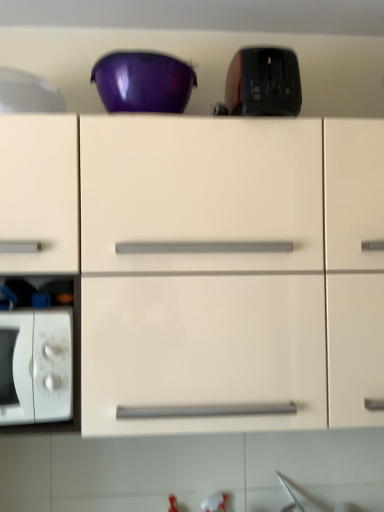
Question: Can you confirm if black glossy toaster at upper center, the second appliance positioned from the left, is taller than matte white cabinet at center?

Choices:
 (A) no
 (B) yes

Answer: (A)

Question: Does black glossy toaster at upper center, the second appliance positioned from the left, turn towards matte white cabinet at center?

Choices:
 (A) yes
 (B) no

Answer: (B)

Question: Is black glossy toaster at upper center, which is the first appliance in right-to-left order, touching matte white cabinet at center?

Choices:
 (A) no
 (B) yes

Answer: (A)

Question: Is black glossy toaster at upper center, the second appliance positioned from the left, completely or partially outside of matte white cabinet at center?

Choices:
 (A) yes
 (B) no

Answer: (A)

Question: Considering the relative sizes of black glossy toaster at upper center, which is the first appliance in right-to-left order, and matte white cabinet at center in the image provided, is black glossy toaster at upper center, which is the first appliance in right-to-left order, smaller than matte white cabinet at center?

Choices:
 (A) yes
 (B) no

Answer: (A)

Question: Is glossy plastic bowl at upper center inside or outside of white matte microwave oven at lower left?

Choices:
 (A) inside
 (B) outside

Answer: (B)

Question: From the image's perspective, relative to white matte microwave oven at lower left, is glossy plastic bowl at upper center above or below?

Choices:
 (A) below
 (B) above

Answer: (B)

Question: In terms of width, does glossy plastic bowl at upper center look wider or thinner when compared to white matte microwave oven at lower left?

Choices:
 (A) wide
 (B) thin

Answer: (B)

Question: Is point (144, 66) positioned closer to the camera than point (24, 357)?

Choices:
 (A) closer
 (B) farther

Answer: (B)

Question: Considering their positions, is glossy plastic bowl at upper center located in front of or behind white glossy microwave at left, which is the 2th appliance from right to left?

Choices:
 (A) front
 (B) behind

Answer: (A)

Question: Considering the positions of glossy plastic bowl at upper center and white glossy microwave at left, which is the 2th appliance from right to left, in the image, is glossy plastic bowl at upper center wider or thinner than white glossy microwave at left, which is the 2th appliance from right to left,?

Choices:
 (A) wide
 (B) thin

Answer: (A)

Question: From their relative heights in the image, would you say glossy plastic bowl at upper center is taller or shorter than white glossy microwave at left, which is the 2th appliance from right to left?

Choices:
 (A) short
 (B) tall

Answer: (A)

Question: From a real-world perspective, relative to white glossy microwave at left, marked as the first appliance in a left-to-right arrangement, is glossy plastic bowl at upper center vertically above or below?

Choices:
 (A) below
 (B) above

Answer: (A)

Question: Based on their positions, is white glossy microwave at left, which is the 2th appliance from right to left, located to the left or right of black glossy toaster at upper center, which is the first appliance in right-to-left order?

Choices:
 (A) left
 (B) right

Answer: (A)

Question: From the image's perspective, is white glossy microwave at left, which is the 2th appliance from right to left, located above or below black glossy toaster at upper center, the second appliance positioned from the left?

Choices:
 (A) below
 (B) above

Answer: (A)